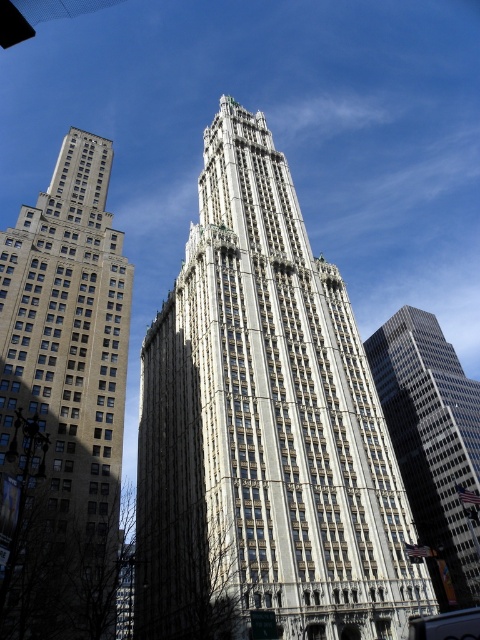
Who is taller, white stone skyscraper at center or glassy reflective skyscraper at right?

white stone skyscraper at center is taller.

Between white stone skyscraper at center and glassy reflective skyscraper at right, which one has less height?

glassy reflective skyscraper at right is shorter.

Between point (336, 468) and point (474, 467), which one is positioned behind?

Positioned behind is point (474, 467).

The image size is (480, 640). Find the location of `white stone skyscraper at center`. white stone skyscraper at center is located at coordinates (264, 428).

Does beige stone building at left have a larger size compared to glassy reflective skyscraper at right?

Actually, beige stone building at left might be smaller than glassy reflective skyscraper at right.

Is beige stone building at left above glassy reflective skyscraper at right?

Yes, beige stone building at left is above glassy reflective skyscraper at right.

Which is behind, point (70, 131) or point (397, 445)?

Point (70, 131)

This screenshot has height=640, width=480. What are the coordinates of `beige stone building at left` in the screenshot? It's located at (64, 397).

Does point (379, 620) lie in front of point (17, 339)?

Yes, it is in front of point (17, 339).

Which of these two, white stone skyscraper at center or beige stone building at left, stands taller?

With more height is white stone skyscraper at center.

Is point (166, 556) behind point (12, 560)?

Yes, point (166, 556) is behind point (12, 560).

Where is `white stone skyscraper at center`? This screenshot has width=480, height=640. white stone skyscraper at center is located at coordinates (264, 428).